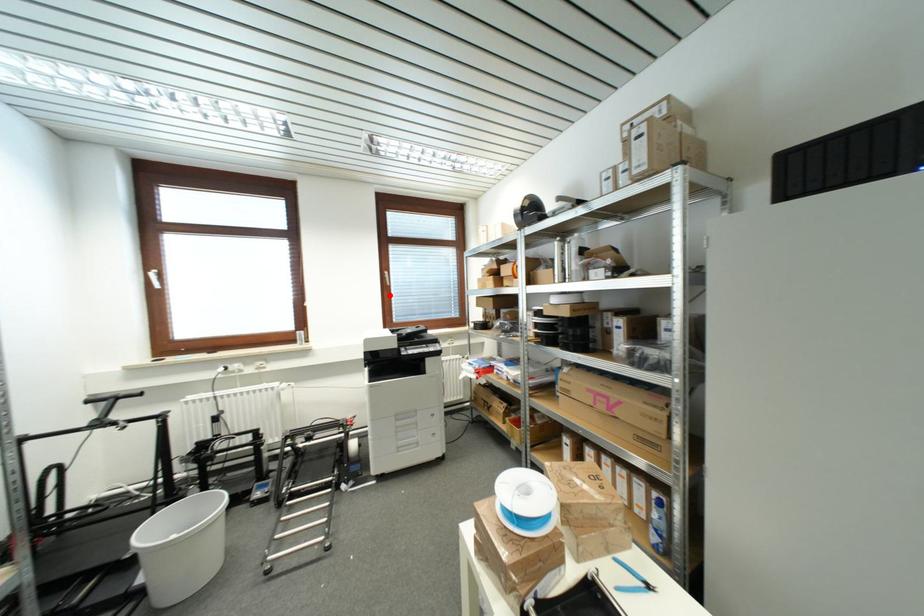
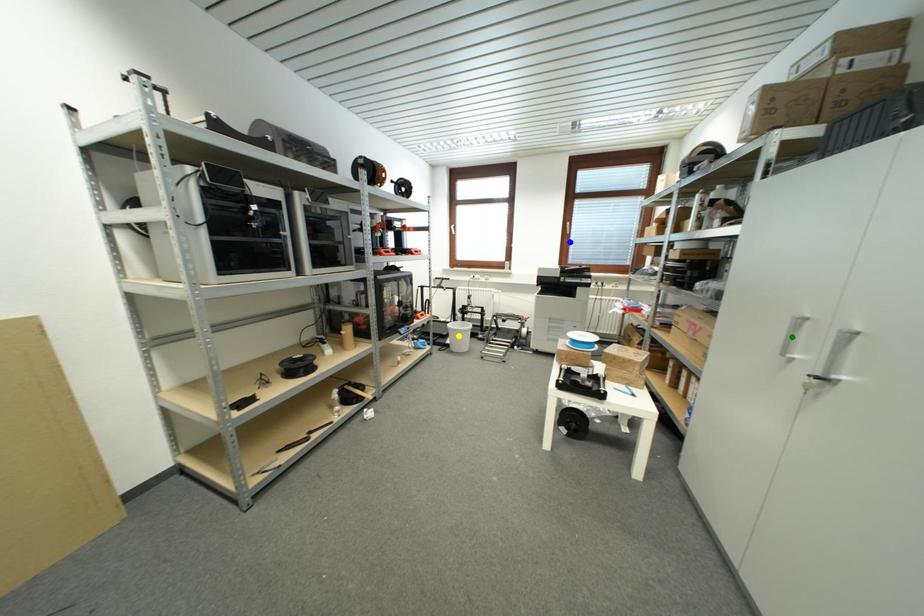
Question: I am providing you with two images of the same scene from different viewpoints. A red point is marked on the first image. You are given multiple points on the second image. Which point in image 2 represents the same 3d spot as the red point in image 1?

Choices:
 (A) yellow point
 (B) blue point
 (C) green point

Answer: (B)